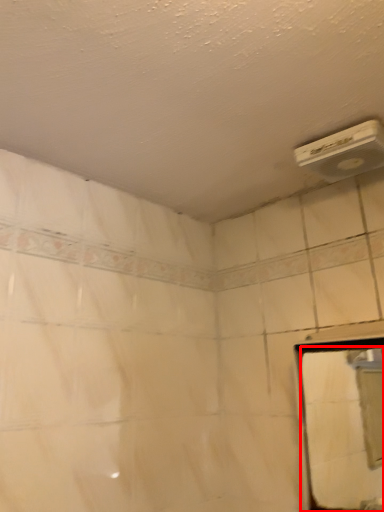
Question: From the image's perspective, what is the correct spatial relationship of mirror (annotated by the red box) in relation to air conditioning?

Choices:
 (A) above
 (B) below

Answer: (B)